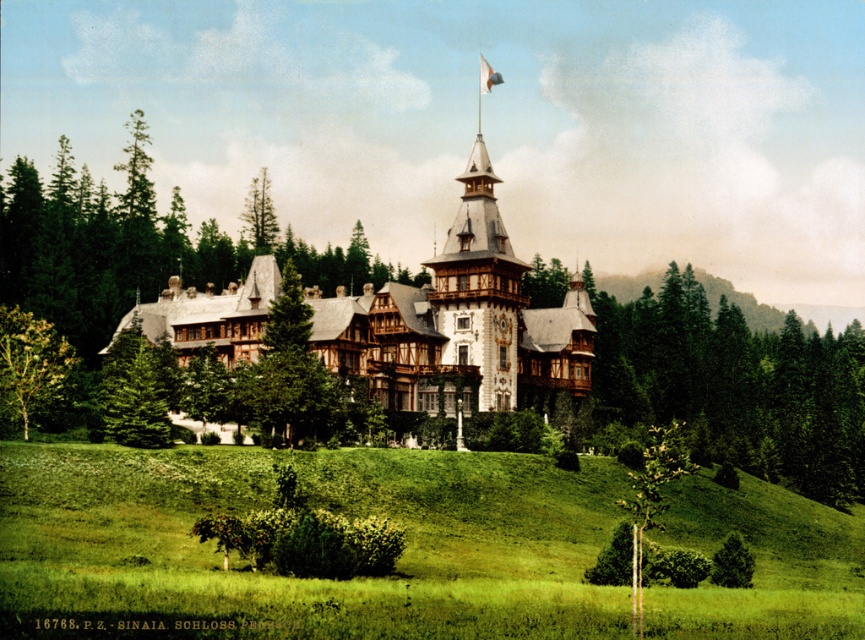
Who is positioned more to the right, green grassy hillside at center or green leafy tree at lower left?

green grassy hillside at center is more to the right.

Does green grassy hillside at center have a smaller size compared to green leafy tree at lower left?

Incorrect, green grassy hillside at center is not smaller in size than green leafy tree at lower left.

Find the location of a particular element. The width and height of the screenshot is (865, 640). green grassy hillside at center is located at coordinates (303, 579).

Who is more forward, [484,243] or [43,348]?

Point [43,348] is in front.

Which of these two, wooden timber castle at center or green leafy tree at lower left, stands taller?

wooden timber castle at center is taller.

What do you see at coordinates (460, 321) in the screenshot? I see `wooden timber castle at center` at bounding box center [460, 321].

Find the location of `wooden timber castle at center`. wooden timber castle at center is located at coordinates (460, 321).

Can you confirm if wooden timber castle at center is smaller than white fabric flag at upper center?

Incorrect, wooden timber castle at center is not smaller in size than white fabric flag at upper center.

Is point (587, 314) closer to camera compared to point (489, 67)?

Yes, it is in front of point (489, 67).

Where is `wooden timber castle at center`? Image resolution: width=865 pixels, height=640 pixels. wooden timber castle at center is located at coordinates (460, 321).